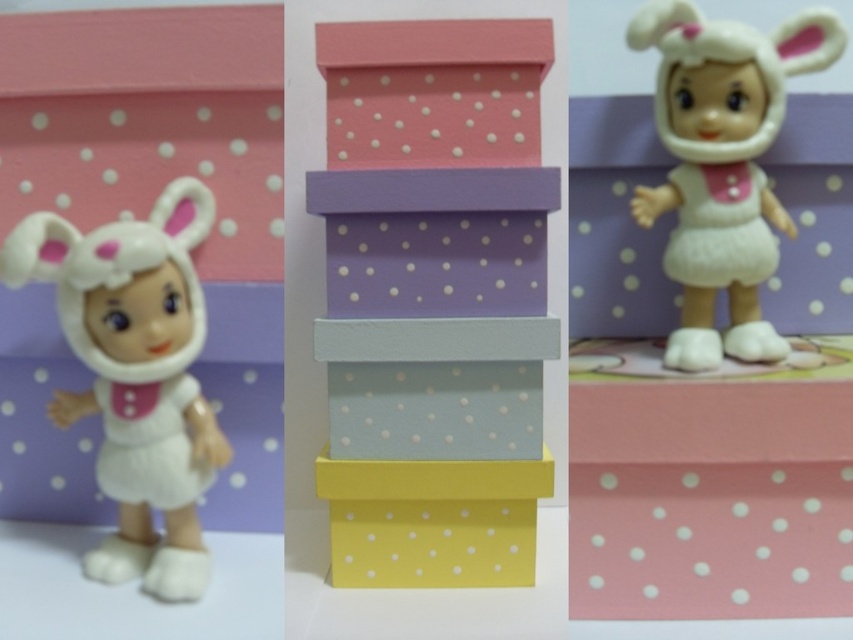
In the scene shown: You are organizing a childrens party and want to place the white plush toy at left and the yellow matte box at center on a shelf. Considering their sizes, which one should you place first to ensure stability?

The white plush toy at left is larger than the yellow matte box at center, so place the larger toy first to provide a stable base for the smaller box.

You are a child trying to reach the white plush doll at upper right from the left section. Can you reach it without moving past the pastel polka dot boxes at center?

The white plush doll at upper right is behind the pastel polka dot boxes at center, so you cannot reach it without moving past them.

In the scene shown: You are organizing a shelf and need to place the white plush toy at left and the yellow matte box at center. According to the image, which object should be placed to the right of the other?

The white plush toy at left is positioned on the left side of the yellow matte box at center, so the yellow matte box at center should be placed to the right of the white plush toy at left.